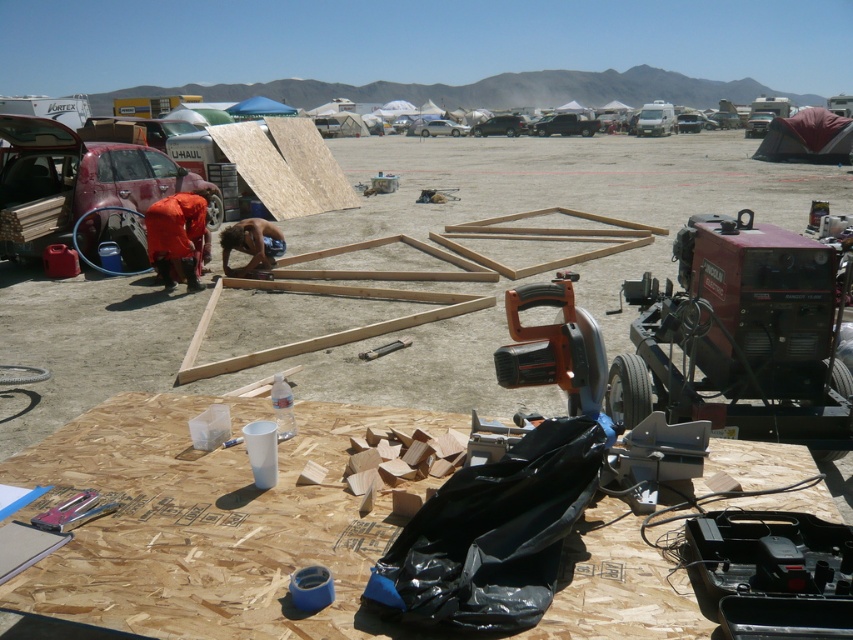
Who is positioned more to the right, naked wood at center or metallic silver tool at center?

metallic silver tool at center

Find the location of `naked wood at center`. naked wood at center is located at coordinates (251, 244).

Between point (277, 248) and point (398, 342), which one is positioned behind?

Point (277, 248)

You are a GUI agent. You are given a task and a screenshot of the screen. Output one action in this format:
    pyautogui.click(x=<x>, y=<y>)
    Task: Click on the naked wood at center
    The image size is (853, 640).
    Given the screenshot: What is the action you would take?
    pyautogui.click(x=251, y=244)

Who is more distant from viewer, (196,545) or (560,131)?

Point (560,131)

Can you confirm if brown osb board at center is wider than black matte truck at center?

Incorrect, brown osb board at center's width does not surpass black matte truck at center's.

Locate an element on the screen. This screenshot has width=853, height=640. brown osb board at center is located at coordinates (202, 524).

Does black matte truck at center have a larger size compared to black matte car at center?

Indeed, black matte truck at center has a larger size compared to black matte car at center.

Measure the distance between black matte truck at center and camera.

black matte truck at center and camera are 100.35 feet apart.

Does point (560, 116) come in front of point (515, 113)?

Yes, point (560, 116) is closer to viewer.

At what (x,y) coordinates should I click in order to perform the action: click on black matte truck at center. Please return your answer as a coordinate pair (x, y). Looking at the image, I should click on [566, 124].